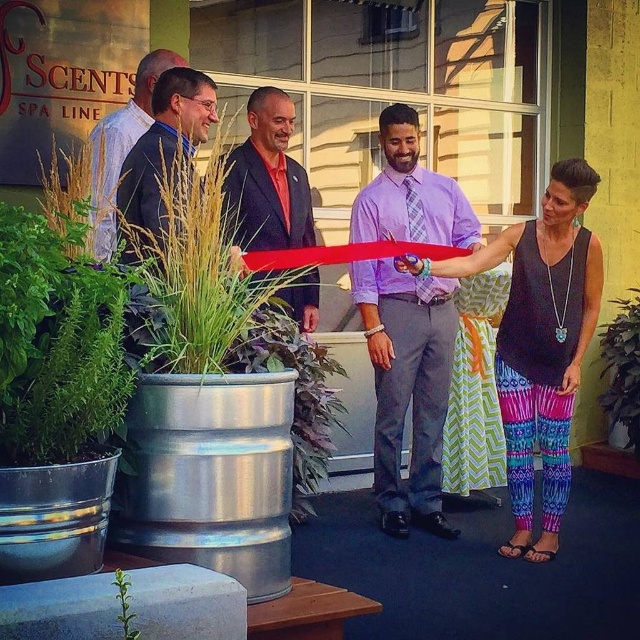
Question: Is dark blue suit at upper left above green leafy plant at lower left?

Choices:
 (A) no
 (B) yes

Answer: (B)

Question: Which object appears closest to the camera in this image?

Choices:
 (A) green leafy plant at lower left
 (B) lavender plaid shirt at center

Answer: (A)

Question: Which point is closer to the camera?

Choices:
 (A) [616, 422]
 (B) [394, 524]

Answer: (B)

Question: Which point is farther to the camera?

Choices:
 (A) (125, 605)
 (B) (556, 196)
 (C) (116, 120)

Answer: (C)

Question: Is lavender plaid shirt at center positioned in front of green leafy plant at center?

Choices:
 (A) yes
 (B) no

Answer: (A)

Question: From the image, what is the correct spatial relationship of matte black suit at center in relation to dark blue suit at upper left?

Choices:
 (A) right
 (B) left

Answer: (A)